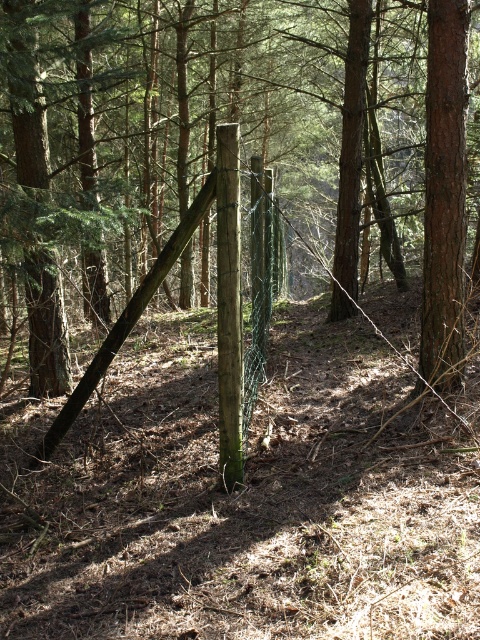
Question: Which point is closer to the camera?

Choices:
 (A) green wire mesh fence at center
 (B) smooth brown wooden post at center

Answer: (B)

Question: Where is green wire mesh fence at center located in relation to smooth brown wooden post at center in the image?

Choices:
 (A) right
 (B) left

Answer: (B)

Question: Which of these objects is positioned closest to the smooth brown tree trunk at right?

Choices:
 (A) green wire mesh fence at center
 (B) smooth brown wooden post at center

Answer: (B)

Question: Which point appears closest to the camera in this image?

Choices:
 (A) (433, 99)
 (B) (156, 262)

Answer: (B)

Question: Can you confirm if smooth brown tree trunk at right is positioned to the right of smooth brown wooden post at center?

Choices:
 (A) no
 (B) yes

Answer: (B)

Question: Does green wire mesh fence at center lie in front of smooth brown wooden post at center?

Choices:
 (A) yes
 (B) no

Answer: (B)